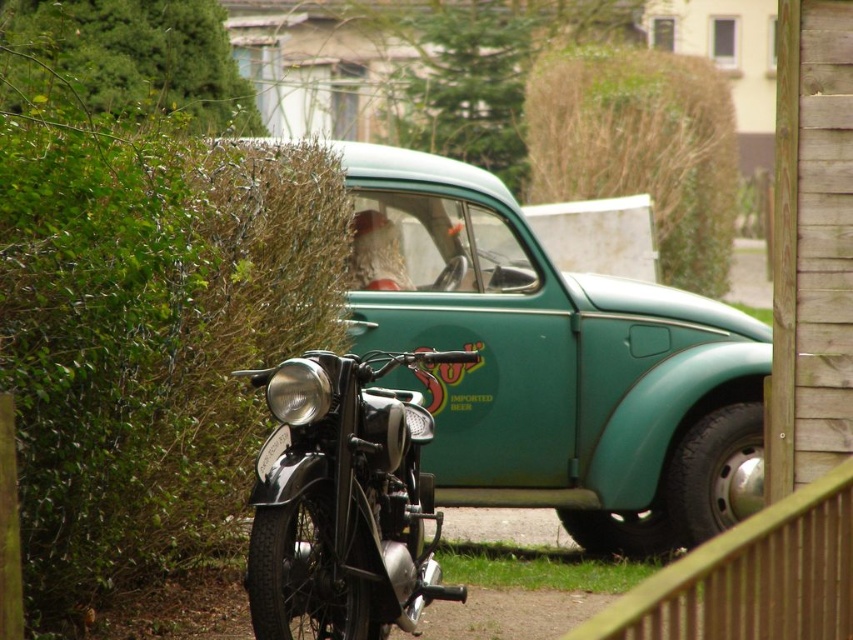
Does brown textured hedge at upper center appear on the right side of metallic silver at front?

Yes, brown textured hedge at upper center is to the right of metallic silver at front.

Describe the element at coordinates (640, 147) in the screenshot. I see `brown textured hedge at upper center` at that location.

The width and height of the screenshot is (853, 640). I want to click on brown textured hedge at upper center, so click(640, 147).

Does teal matte car at center have a greater height compared to green leafy hedge at upper left?

Yes.

How much distance is there between teal matte car at center and green leafy hedge at upper left?

teal matte car at center and green leafy hedge at upper left are 16.29 feet apart from each other.

Does point (648, 296) come farther from viewer compared to point (115, 67)?

No, (648, 296) is in front of (115, 67).

Locate an element on the screen. This screenshot has width=853, height=640. teal matte car at center is located at coordinates (552, 364).

Is point (526, 445) in front of point (299, 602)?

No, (526, 445) is behind (299, 602).

Who is positioned more to the left, teal matte car at center or shiny black motorcycle at center?

shiny black motorcycle at center

Does point (610, 467) lie in front of point (415, 474)?

No, it is not.

You are a GUI agent. You are given a task and a screenshot of the screen. Output one action in this format:
    pyautogui.click(x=<x>, y=<y>)
    Task: Click on the teal matte car at center
    
    Given the screenshot: What is the action you would take?
    pyautogui.click(x=552, y=364)